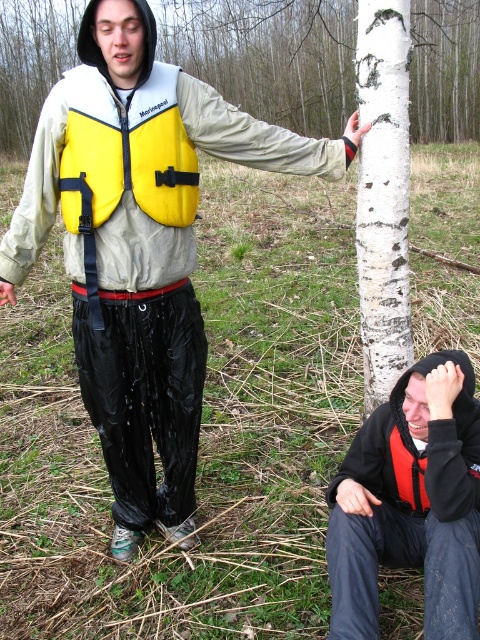
Question: Is black matte jacket at lower right further to camera compared to red matte life jacket at lower right?

Choices:
 (A) no
 (B) yes

Answer: (A)

Question: Is the position of black matte jacket at lower right more distant than that of red matte life jacket at lower right?

Choices:
 (A) yes
 (B) no

Answer: (B)

Question: Which of the following is the closest to the observer?

Choices:
 (A) (142, 134)
 (B) (280, 54)

Answer: (A)

Question: Among these points, which one is farthest from the camera?

Choices:
 (A) (162, 145)
 (B) (399, 449)
 (C) (407, 486)

Answer: (C)

Question: Does black matte jacket at lower right have a greater width compared to red matte life jacket at lower right?

Choices:
 (A) no
 (B) yes

Answer: (B)

Question: Which point is closer to the camera?

Choices:
 (A) yellow matte life jacket at center
 (B) white bark tree at center
 (C) yellow neoprene life vest at upper center

Answer: (C)